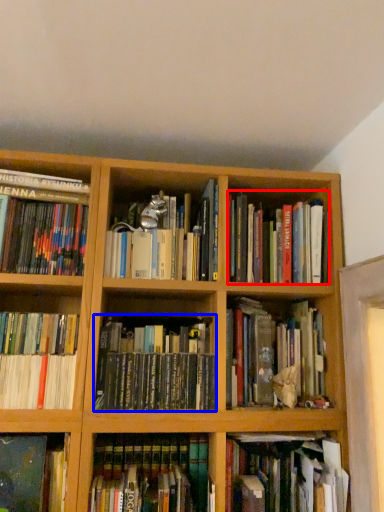
Question: Which point is closer to the camera, book (highlighted by a red box) or book (highlighted by a blue box)?

Choices:
 (A) book
 (B) book

Answer: (B)